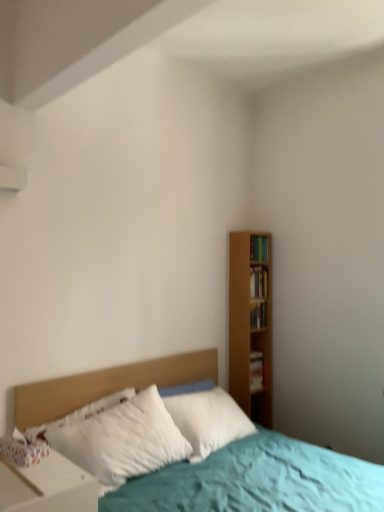
Question: Can you see hardcover book at right, which is counted as the first book, starting from the bottom, touching wooden bookshelf at right, arranged as the 3th book when viewed from the top?

Choices:
 (A) no
 (B) yes

Answer: (A)

Question: Does hardcover book at right, which is counted as the first book, starting from the bottom, have a greater width compared to wooden bookshelf at right, arranged as the 3th book when viewed from the top?

Choices:
 (A) no
 (B) yes

Answer: (B)

Question: From the image's perspective, would you say hardcover book at right, the fourth book when ordered from top to bottom, is positioned over wooden bookshelf at right, arranged as the 3th book when viewed from the top?

Choices:
 (A) yes
 (B) no

Answer: (B)

Question: Is hardcover book at right, the fourth book when ordered from top to bottom, thinner than wooden bookshelf at right, which is the second book from bottom to top?

Choices:
 (A) no
 (B) yes

Answer: (A)

Question: Is hardcover book at right, which is counted as the first book, starting from the bottom, outside of wooden bookshelf at right, which is the second book from bottom to top?

Choices:
 (A) yes
 (B) no

Answer: (A)

Question: In terms of height, does white glossy nightstand at lower left look taller or shorter compared to wooden bookshelf at right, which is the second book from bottom to top?

Choices:
 (A) short
 (B) tall

Answer: (B)

Question: Looking at their shapes, would you say white glossy nightstand at lower left is wider or thinner than wooden bookshelf at right, arranged as the 3th book when viewed from the top?

Choices:
 (A) thin
 (B) wide

Answer: (B)

Question: Visually, is white glossy nightstand at lower left positioned to the left or to the right of wooden bookshelf at right, which is the second book from bottom to top?

Choices:
 (A) right
 (B) left

Answer: (B)

Question: Considering the positions of point (71, 501) and point (253, 322), is point (71, 501) closer or farther from the camera than point (253, 322)?

Choices:
 (A) closer
 (B) farther

Answer: (A)

Question: Considering the positions of point (259, 286) and point (157, 464), is point (259, 286) closer or farther from the camera than point (157, 464)?

Choices:
 (A) closer
 (B) farther

Answer: (B)

Question: Visually, is wooden bookshelf at right, the third book when ordered from bottom to top, positioned to the left or to the right of white soft pillow at center?

Choices:
 (A) left
 (B) right

Answer: (B)

Question: Which is correct: wooden bookshelf at right, the 2th book viewed from the top, is inside white soft pillow at center, or outside of it?

Choices:
 (A) inside
 (B) outside

Answer: (B)

Question: From a real-world perspective, is wooden bookshelf at right, the 2th book viewed from the top, above or below white soft pillow at center?

Choices:
 (A) above
 (B) below

Answer: (A)

Question: Considering the positions of wooden bookshelf at right, which is the second book from bottom to top, and white soft pillow at center in the image, is wooden bookshelf at right, which is the second book from bottom to top, wider or thinner than white soft pillow at center?

Choices:
 (A) wide
 (B) thin

Answer: (B)

Question: Does point (258, 325) appear closer or farther from the camera than point (94, 415)?

Choices:
 (A) closer
 (B) farther

Answer: (B)